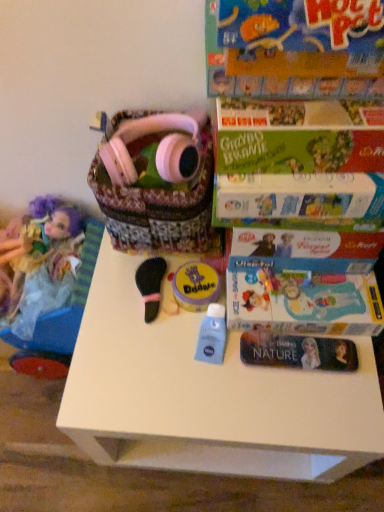
Image resolution: width=384 pixels, height=512 pixels. Find the location of `free location in front of black felt brush at center, positioned as the second toy in right-to-left order`. free location in front of black felt brush at center, positioned as the second toy in right-to-left order is located at coordinates (145, 374).